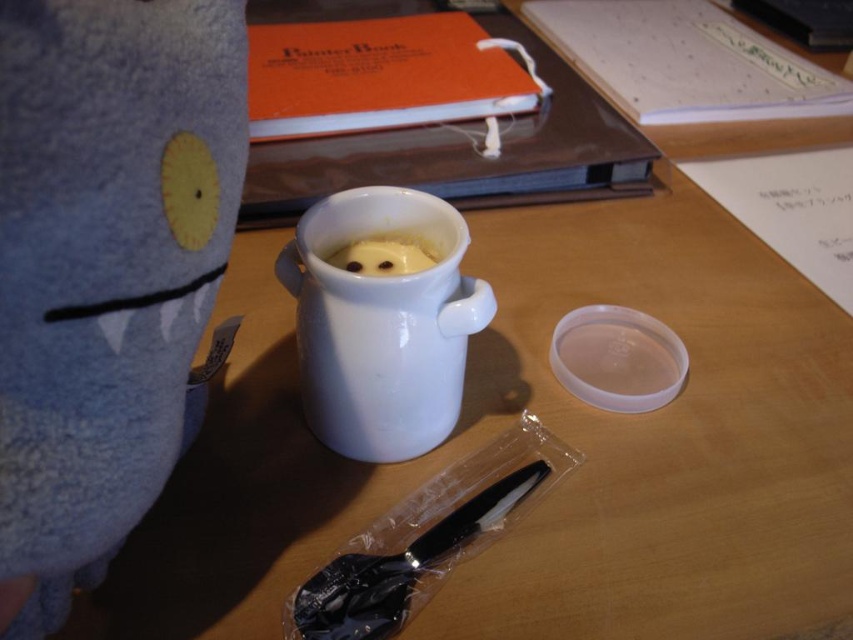
You are trying to decide which cup to use for your hot chocolate. The white glossy mug at center and the white matte coffee cup at center are both on the desk. Which one has a wider opening?

The white glossy mug at center is wider than the white matte coffee cup at center, so it has a wider opening.

You are a barista preparing drinks and see both the white glossy mug at center and the white matte coffee cup at center. Which one is sitting directly below the other?

The white glossy mug at center is positioned under the white matte coffee cup at center, so the white glossy mug at center is sitting directly below the white matte coffee cup at center.

You are organizing a tea party and need to place the white glossy mug at center and the white matte coffee cup at center on a table. Based on the scene, which one is on the left?

The white glossy mug at center is positioned on the right side of white matte coffee cup at center, so the white matte coffee cup at center is on the left.